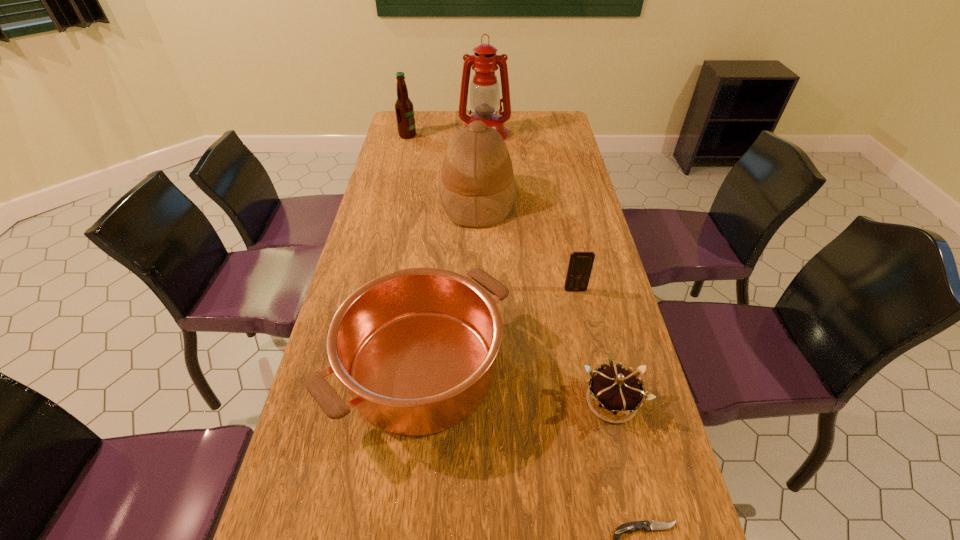
In the image, there is a desktop. Where is `vacant space at the left edge`? This screenshot has height=540, width=960. vacant space at the left edge is located at coordinates (384, 190).

The height and width of the screenshot is (540, 960). I want to click on vacant space at the right edge, so click(650, 428).

You are a GUI agent. You are given a task and a screenshot of the screen. Output one action in this format:
    pyautogui.click(x=<x>, y=<y>)
    Task: Click on the free space between the beer bottle and the oil lamp
    
    Given the screenshot: What is the action you would take?
    pyautogui.click(x=446, y=134)

This screenshot has height=540, width=960. What are the coordinates of `blank region between the sixth tallest object and the beer bottle` in the screenshot? It's located at (510, 268).

The image size is (960, 540). I want to click on free space between the cellular telephone and the second shortest object, so click(x=593, y=346).

In order to click on empty location between the oil lamp and the beer bottle in this screenshot , I will do `click(446, 134)`.

This screenshot has width=960, height=540. Identify the location of blank region between the beer bottle and the saucepan. click(x=415, y=252).

The width and height of the screenshot is (960, 540). In order to click on vacant area between the tallest object and the saucepan in this screenshot , I will do `click(453, 251)`.

This screenshot has width=960, height=540. Identify the location of free spot between the tallest object and the second shortest object. (548, 267).

Identify which object is the fifth closest to the nearest object. Please provide its 2D coordinates. Your answer should be formatted as a tuple, i.e. [(x, y)], where the tuple contains the x and y coordinates of a point satisfying the conditions above.

[(485, 99)]